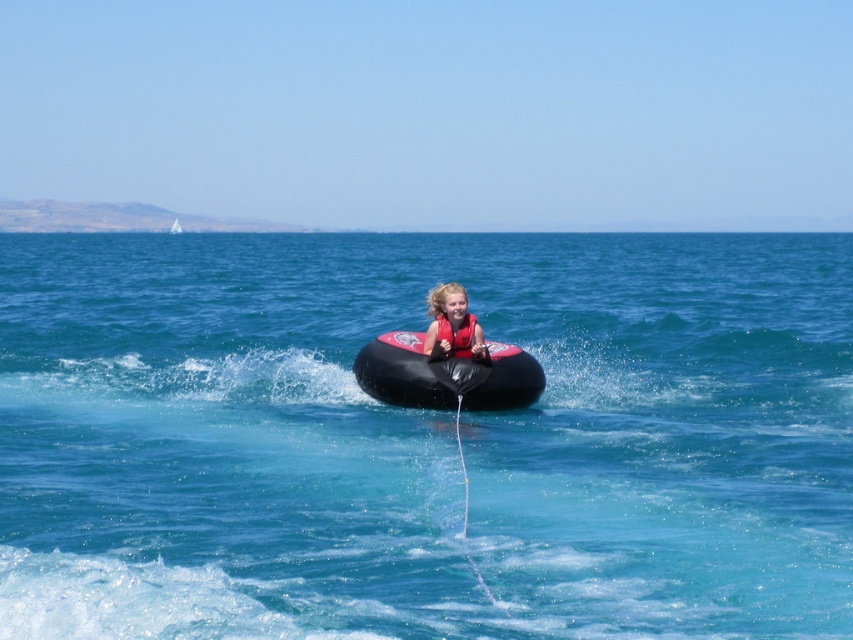
You are a safety inspector checking the positioning of the matte red life vest at center in the water tubing scene. According to regulations, the life vest must be positioned at coordinates between 0.5 and 0.6 on both the x and y axes. Is the current position compliant?

The matte red life vest at center is located at point (451,324), which falls within the required range of 0.5 to 0.6 on both axes. Therefore, the position is compliant with the regulations.